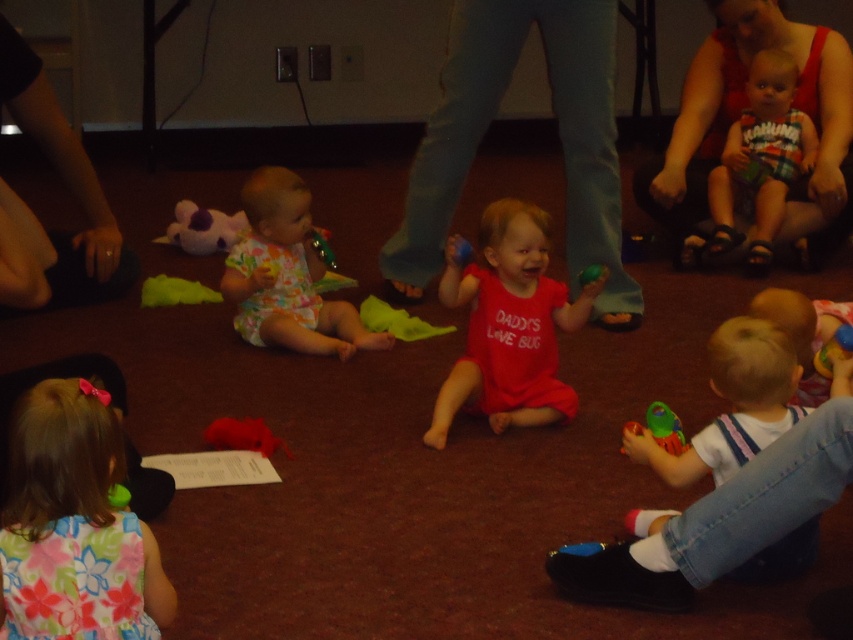
Question: Is floral fabric baby at center wider than rubber teething ring at lower left?

Choices:
 (A) no
 (B) yes

Answer: (B)

Question: Which point is closer to the camera?

Choices:
 (A) green rubber ball at center
 (B) fluffy red toy at lower left
 (C) green rubber ball at lower left

Answer: (C)

Question: Is the position of floral fabric dress at lower left more distant than that of floral fabric baby at center?

Choices:
 (A) no
 (B) yes

Answer: (A)

Question: Can you confirm if white soft toy at lower right is positioned below rubber teething ring at lower left?

Choices:
 (A) yes
 (B) no

Answer: (A)

Question: Which of these objects is positioned closest to the rubber yellow toy at lower right?

Choices:
 (A) floral fabric dress at lower left
 (B) red matte romper at center
 (C) green rubber ball at lower left
 (D) purple plush toy at upper left

Answer: (B)

Question: Which of the following is the farthest from the observer?

Choices:
 (A) (161, 243)
 (B) (401, 337)

Answer: (A)